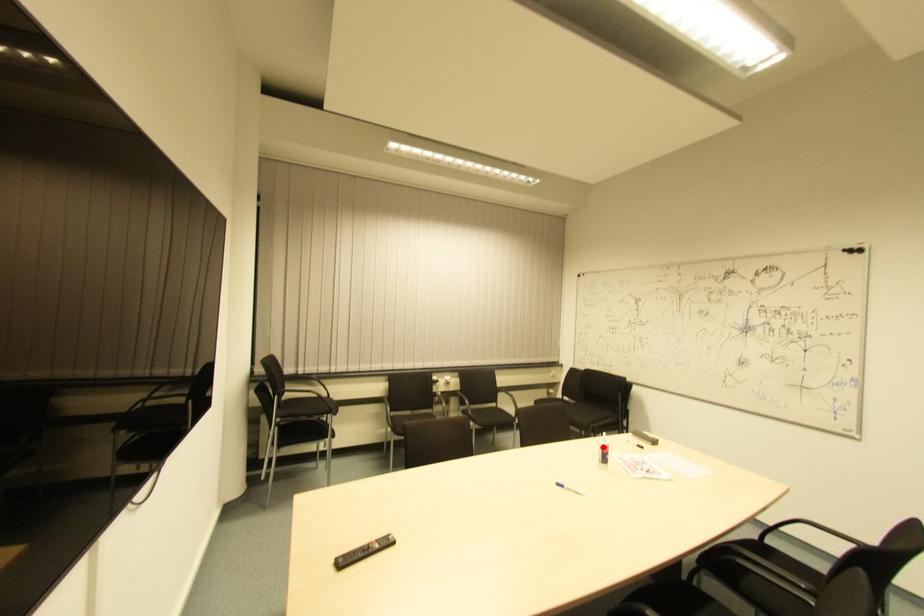
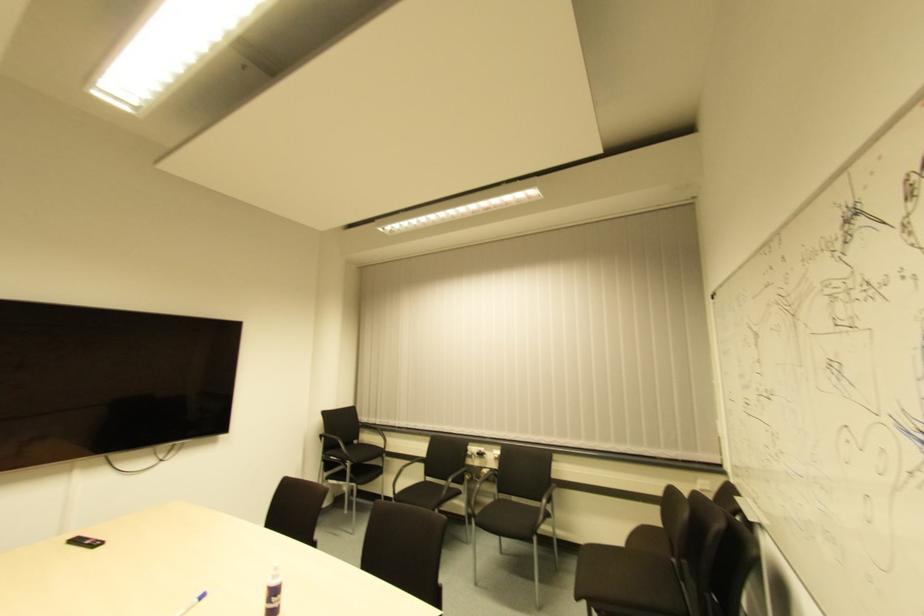
Where in the second image is the point corresponding to the highlighted location from the first image?

(274, 586)